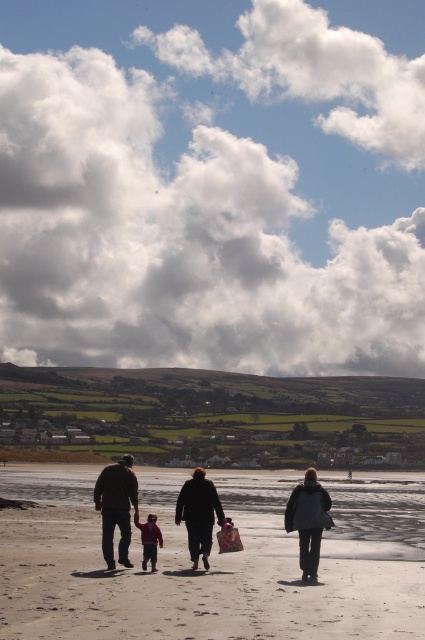
Question: Which point is closer to the camera?

Choices:
 (A) light brown sand at center
 (B) matte red sweater at center
 (C) dark gray coat at center

Answer: (A)

Question: Can you confirm if light brown sand at center is positioned above matte red sweater at center?

Choices:
 (A) no
 (B) yes

Answer: (A)

Question: Is dark gray coat at center above brown leather jacket at lower left?

Choices:
 (A) yes
 (B) no

Answer: (B)

Question: Is the position of light brown sand at center more distant than that of dark gray coat at center?

Choices:
 (A) yes
 (B) no

Answer: (B)

Question: Which object appears closest to the camera in this image?

Choices:
 (A) brown leather jacket at lower left
 (B) light brown sand at center
 (C) dark gray coat at center

Answer: (B)

Question: Which point appears closest to the camera in this image?

Choices:
 (A) (297, 500)
 (B) (155, 522)
 (C) (122, 496)
 (D) (360, 564)

Answer: (C)